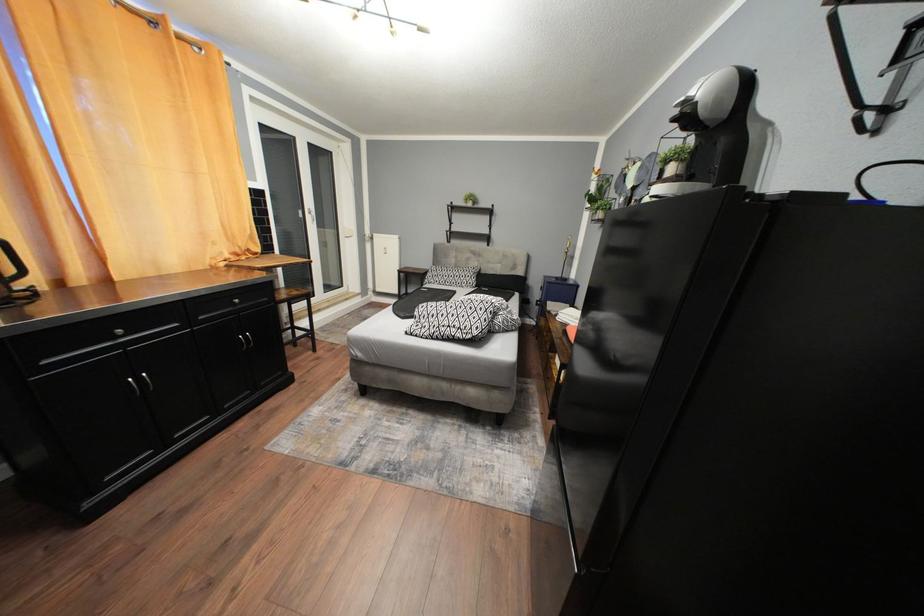
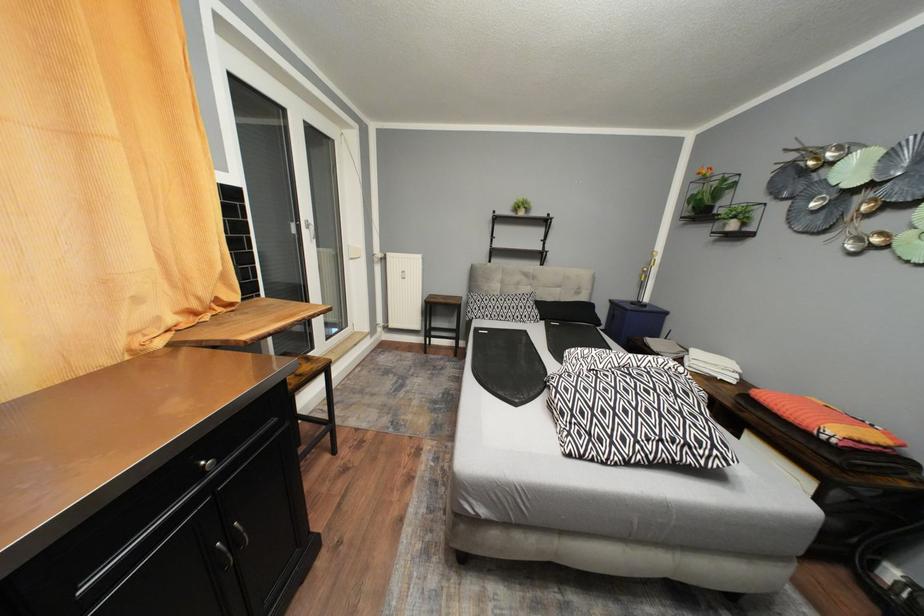
The images are taken continuously from a first-person perspective. In which direction are you moving?

The cameraman walked toward left, forward.